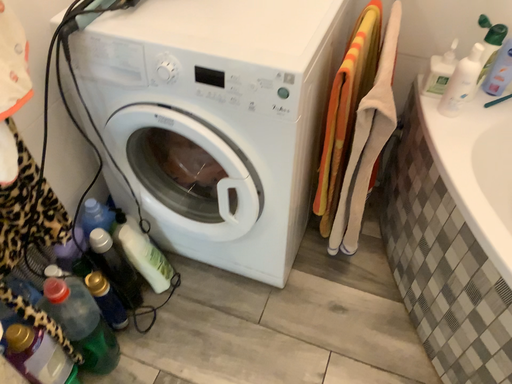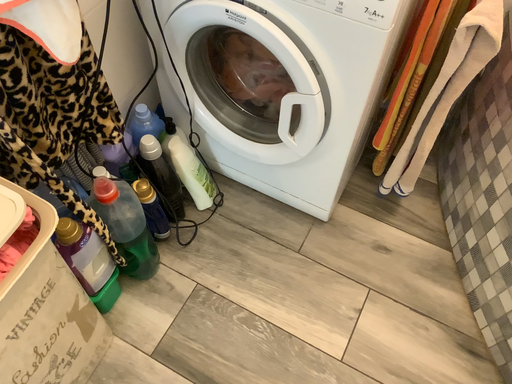
Question: How did the camera likely rotate when shooting the video?

Choices:
 (A) rotated downward
 (B) rotated upward

Answer: (A)